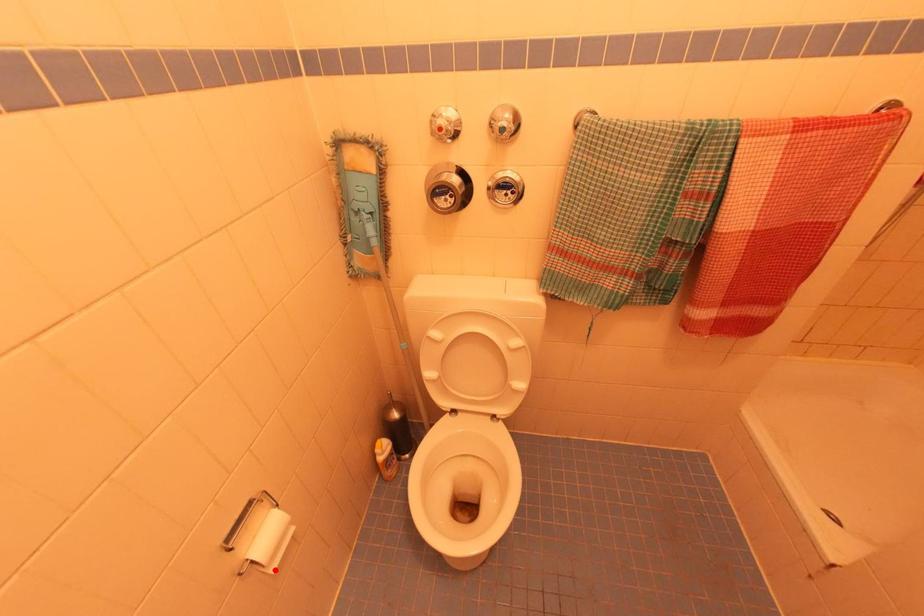
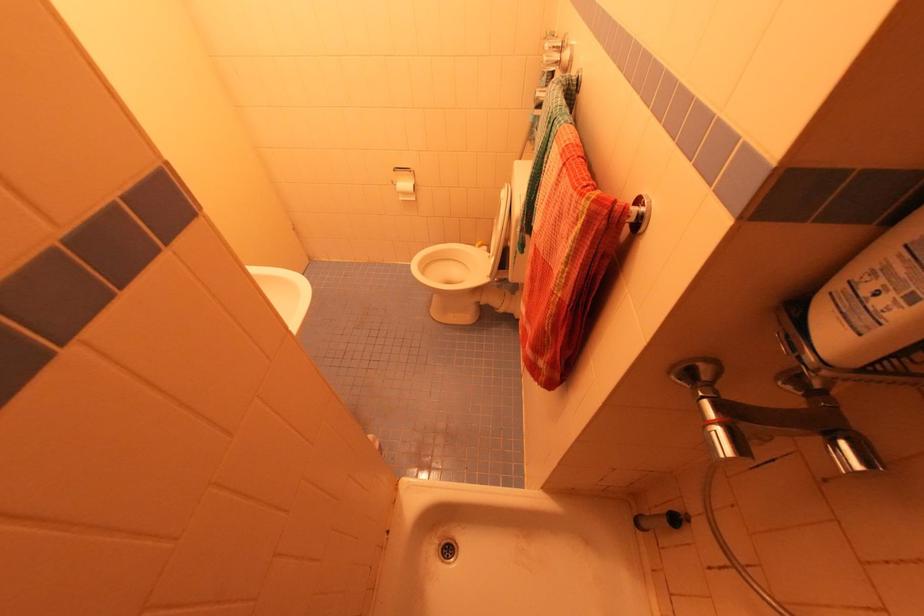
Question: I am providing you with two images of the same scene from different viewpoints. Given a red point in image1, look at the same physical point in image2. Is it:

Choices:
 (A) Closer to the viewpoint
 (B) Farther from the viewpoint

Answer: (A)